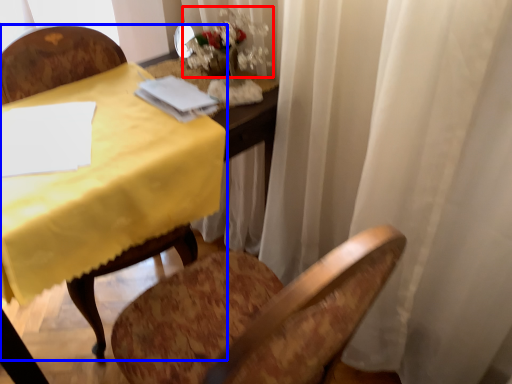
Question: Which point is further to the camera, floral arrangement (highlighted by a red box) or chair (highlighted by a blue box)?

Choices:
 (A) floral arrangement
 (B) chair

Answer: (A)